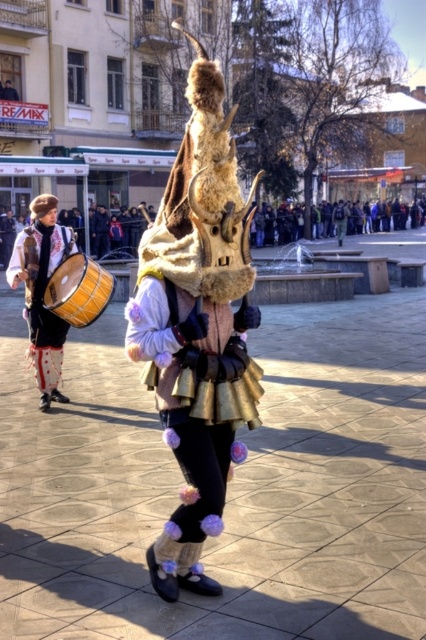
Can you confirm if matte brown drum at left is thinner than wooden drum at center?

No.

Image resolution: width=426 pixels, height=640 pixels. What do you see at coordinates (42, 296) in the screenshot?
I see `matte brown drum at left` at bounding box center [42, 296].

I want to click on matte brown drum at left, so click(42, 296).